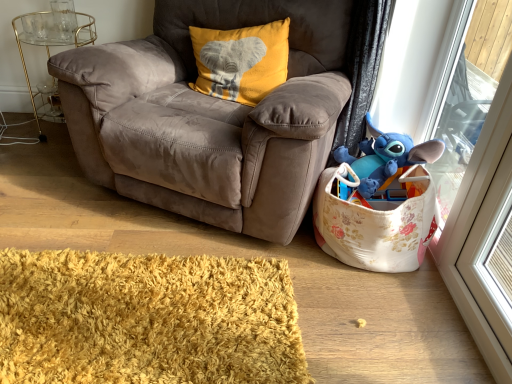
Describe the element at coordinates (49, 50) in the screenshot. This screenshot has height=384, width=512. I see `gold metallic side table at left` at that location.

Describe the element at coordinates (236, 112) in the screenshot. I see `suede brown armchair at center` at that location.

Image resolution: width=512 pixels, height=384 pixels. Describe the element at coordinates (147, 319) in the screenshot. I see `yellow shaggy rug at lower left` at that location.

The height and width of the screenshot is (384, 512). In order to click on gold metallic side table at left in this screenshot , I will do `click(49, 50)`.

Considering the relative positions of blue plush toy at right and floral fabric toy storage at lower right in the image provided, is blue plush toy at right to the right of floral fabric toy storage at lower right from the viewer's perspective?

Correct, you'll find blue plush toy at right to the right of floral fabric toy storage at lower right.

Is blue plush toy at right looking in the opposite direction of floral fabric toy storage at lower right?

Yes.

From the image's perspective, is blue plush toy at right positioned above or below floral fabric toy storage at lower right?

blue plush toy at right is above floral fabric toy storage at lower right.

Considering the positions of point (373, 177) and point (421, 167), is point (373, 177) closer or farther from the camera than point (421, 167)?

Point (373, 177) is farther from the camera than point (421, 167).

Are suede brown armchair at center and floral fabric toy storage at lower right located far from each other?

Actually, suede brown armchair at center and floral fabric toy storage at lower right are a little close together.

Is point (168, 198) positioned behind point (368, 263)?

Yes, it is behind point (368, 263).

Looking at this image, in terms of height, does suede brown armchair at center look taller or shorter compared to floral fabric toy storage at lower right?

In the image, suede brown armchair at center appears to be taller than floral fabric toy storage at lower right.

Is yellow shaggy rug at lower left at the left side of gold metallic side table at left?

Incorrect, yellow shaggy rug at lower left is not on the left side of gold metallic side table at left.

Which point is more forward, (4, 323) or (45, 32)?

The point (4, 323) is in front.

From a real-world perspective, is yellow shaggy rug at lower left physically above gold metallic side table at left?

No, from a real-world perspective, yellow shaggy rug at lower left is not above gold metallic side table at left.

Is yellow shaggy rug at lower left turned away from gold metallic side table at left?

No, yellow shaggy rug at lower left's orientation is not away from gold metallic side table at left.

Is blue plush toy at upper right not inside yellow shaggy rug at lower left?

That's correct, blue plush toy at upper right is outside of yellow shaggy rug at lower left.

Is blue plush toy at upper right not close to yellow shaggy rug at lower left?

No, blue plush toy at upper right is in close proximity to yellow shaggy rug at lower left.

Is yellow shaggy rug at lower left at the back of blue plush toy at upper right?

No, blue plush toy at upper right is not facing away from yellow shaggy rug at lower left.

Which object is thinner, blue plush toy at upper right or yellow shaggy rug at lower left?

blue plush toy at upper right is thinner.

From a real-world perspective, is suede brown armchair at center located beneath blue plush toy at right?

Incorrect, from a real-world perspective, suede brown armchair at center is higher than blue plush toy at right.

Which object is closer to the camera, suede brown armchair at center or blue plush toy at right?

suede brown armchair at center is in front.

Considering the sizes of objects suede brown armchair at center and blue plush toy at right in the image provided, who is taller, suede brown armchair at center or blue plush toy at right?

With more height is suede brown armchair at center.

Identify the location of toy that appears behind the suede brown armchair at center. The height and width of the screenshot is (384, 512). (386, 157).

Based on their sizes in the image, would you say gold metallic side table at left is bigger or smaller than yellow velvet pillow at upper center?

In the image, gold metallic side table at left appears to be larger than yellow velvet pillow at upper center.

From the picture: Can you confirm if gold metallic side table at left is thinner than yellow velvet pillow at upper center?

In fact, gold metallic side table at left might be wider than yellow velvet pillow at upper center.

From a real-world perspective, is gold metallic side table at left beneath yellow velvet pillow at upper center?

Yes.

Choose the correct answer: Is gold metallic side table at left inside yellow velvet pillow at upper center or outside it?

→ gold metallic side table at left is not inside yellow velvet pillow at upper center, it's outside.

Is floral fabric toy storage at lower right positioned beyond the bounds of gold metallic side table at left?

Yes, floral fabric toy storage at lower right is outside of gold metallic side table at left.

Which is more to the left, floral fabric toy storage at lower right or gold metallic side table at left?

gold metallic side table at left.

From the picture: From the image's perspective, which is above, floral fabric toy storage at lower right or gold metallic side table at left?

From the image's view, gold metallic side table at left is above.

Where is `bag located underneath the gold metallic side table at left (from a real-world perspective)`? Image resolution: width=512 pixels, height=384 pixels. bag located underneath the gold metallic side table at left (from a real-world perspective) is located at coordinates (375, 225).

At what (x,y) coordinates should I click in order to perform the action: click on toy located behind the floral fabric toy storage at lower right. Please return your answer as a coordinate pair (x, y). The width and height of the screenshot is (512, 384). Looking at the image, I should click on (386, 157).

Locate an element on the screen. The image size is (512, 384). bag that appears on the right of suede brown armchair at center is located at coordinates point(375,225).

Estimate the real-world distances between objects in this image. Which object is closer to gold metallic side table at left, suede brown armchair at center or yellow shaggy rug at lower left?

The object closer to gold metallic side table at left is suede brown armchair at center.

When comparing their distances from yellow velvet pillow at upper center, does yellow shaggy rug at lower left or blue plush toy at right seem further?

yellow shaggy rug at lower left.

Looking at the image, which one is located closer to blue plush toy at upper right, floral fabric toy storage at lower right or blue plush toy at right?

blue plush toy at right is positioned closer to the anchor blue plush toy at upper right.

From the image, which object appears to be nearer to yellow velvet pillow at upper center, blue plush toy at right or yellow shaggy rug at lower left?

Based on the image, blue plush toy at right appears to be nearer to yellow velvet pillow at upper center.

Estimate the real-world distances between objects in this image. Which object is closer to gold metallic side table at left, yellow velvet pillow at upper center or blue plush toy at upper right?

yellow velvet pillow at upper center lies closer to gold metallic side table at left than the other object.

Estimate the real-world distances between objects in this image. Which object is further from gold metallic side table at left, blue plush toy at upper right or blue plush toy at right?

The object further to gold metallic side table at left is blue plush toy at upper right.

When comparing their distances from suede brown armchair at center, does gold metallic side table at left or blue plush toy at right seem closer?

The object closer to suede brown armchair at center is blue plush toy at right.

Considering their positions, is blue plush toy at upper right positioned closer to blue plush toy at right than yellow velvet pillow at upper center?

blue plush toy at upper right lies closer to blue plush toy at right than the other object.

Locate an element on the screen. Image resolution: width=512 pixels, height=384 pixels. chair located between gold metallic side table at left and blue plush toy at right in the left-right direction is located at coordinates (236, 112).

Where is `toy between suede brown armchair at center and blue plush toy at upper right`? The width and height of the screenshot is (512, 384). toy between suede brown armchair at center and blue plush toy at upper right is located at coordinates (386, 157).

In order to click on pillow located between yellow shaggy rug at lower left and blue plush toy at upper right in the left-right direction in this screenshot , I will do `click(241, 61)`.

You are a GUI agent. You are given a task and a screenshot of the screen. Output one action in this format:
    pyautogui.click(x=<x>, y=<y>)
    Task: Click on the pillow between gold metallic side table at left and floral fabric toy storage at lower right in the horizontal direction
    The height and width of the screenshot is (384, 512).
    Given the screenshot: What is the action you would take?
    pyautogui.click(x=241, y=61)